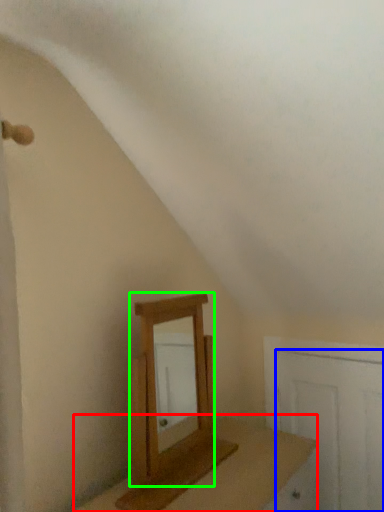
Question: Based on their relative distances, which object is farther from table (highlighted by a red box)? Choose from door (highlighted by a blue box) and mirror (highlighted by a green box).

Choices:
 (A) door
 (B) mirror

Answer: (A)